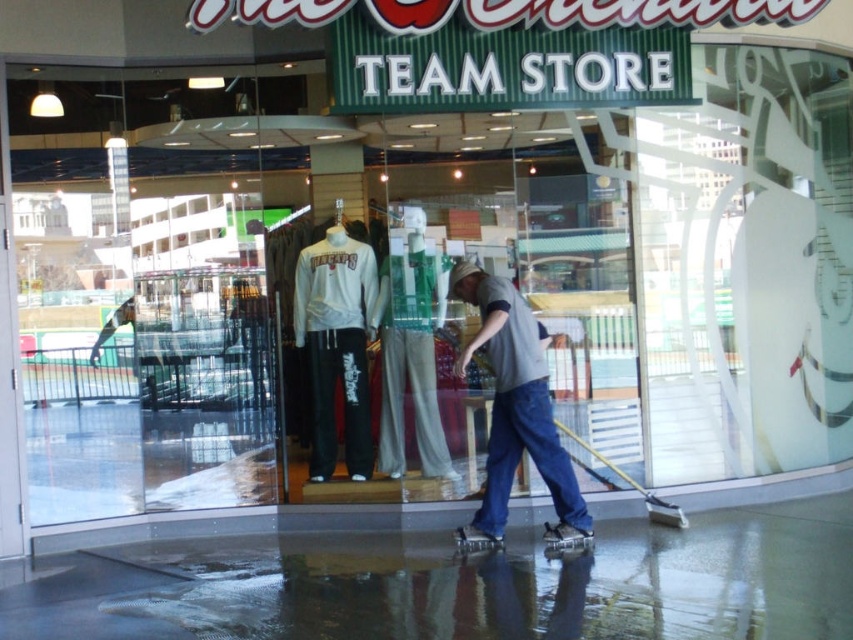
Who is shorter, gray cotton shirt at center or white matte sweatshirt at center?

Standing shorter between the two is gray cotton shirt at center.

Is gray cotton shirt at center to the left of white matte sweatshirt at center from the viewer's perspective?

No, gray cotton shirt at center is not to the left of white matte sweatshirt at center.

Between point (543, 376) and point (367, 307), which one is positioned in front?

Point (543, 376)

You are a GUI agent. You are given a task and a screenshot of the screen. Output one action in this format:
    pyautogui.click(x=<x>, y=<y>)
    Task: Click on the gray cotton shirt at center
    The image size is (853, 640).
    Given the screenshot: What is the action you would take?
    pyautogui.click(x=515, y=410)

Can you confirm if transparent glass door at left is positioned to the right of white matte sweatshirt at center?

In fact, transparent glass door at left is to the left of white matte sweatshirt at center.

Does transparent glass door at left appear on the left side of white matte sweatshirt at center?

Yes, transparent glass door at left is to the left of white matte sweatshirt at center.

Is point (154, 452) positioned before point (360, 273)?

Yes, point (154, 452) is in front of point (360, 273).

Identify the location of transparent glass door at left. This screenshot has width=853, height=640. (149, 289).

Between transparent glass door at center and light gray fabric pants at center, which one appears on the left side from the viewer's perspective?

transparent glass door at center is more to the left.

Which of these two, transparent glass door at center or light gray fabric pants at center, stands taller?

light gray fabric pants at center

The height and width of the screenshot is (640, 853). What are the coordinates of `transparent glass door at center` in the screenshot? It's located at (206, 387).